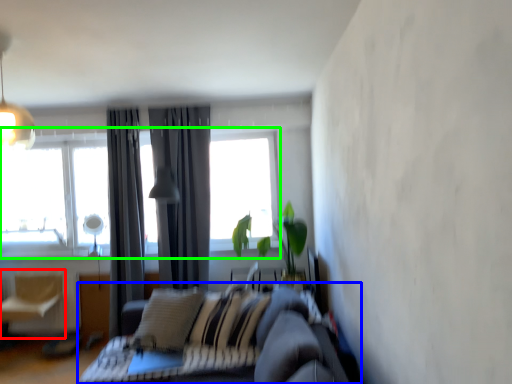
Question: Which is nearer to the swivel chair (highlighted by a red box)? studio couch (highlighted by a blue box) or window (highlighted by a green box).

Choices:
 (A) studio couch
 (B) window

Answer: (B)